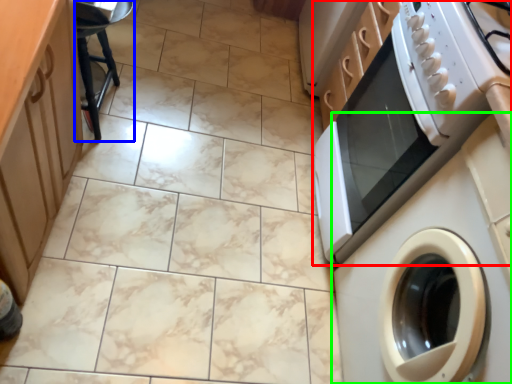
Question: Which object is positioned farthest from home appliance (highlighted by a red box)? Select from bar stool (highlighted by a blue box) and washing machine (highlighted by a green box).

Choices:
 (A) bar stool
 (B) washing machine

Answer: (A)